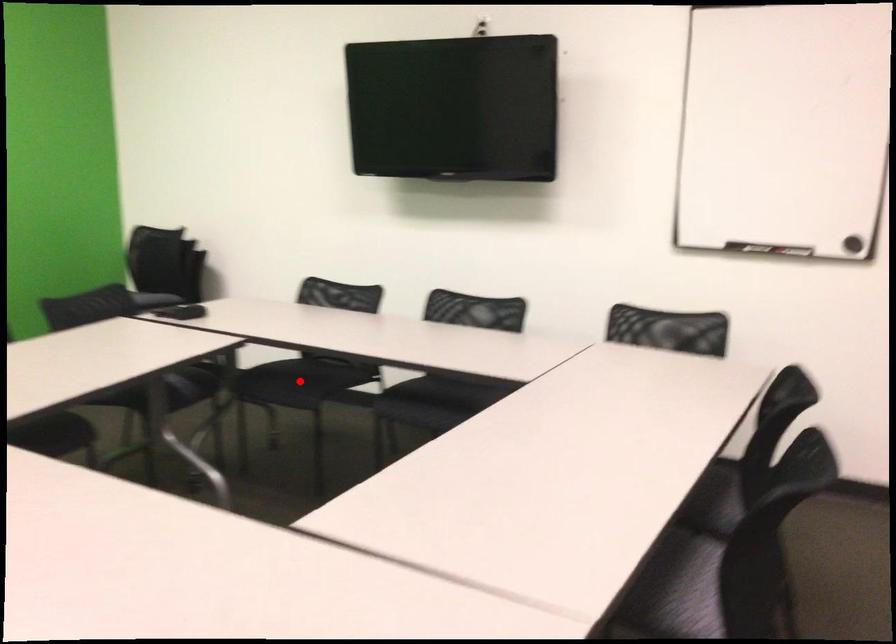
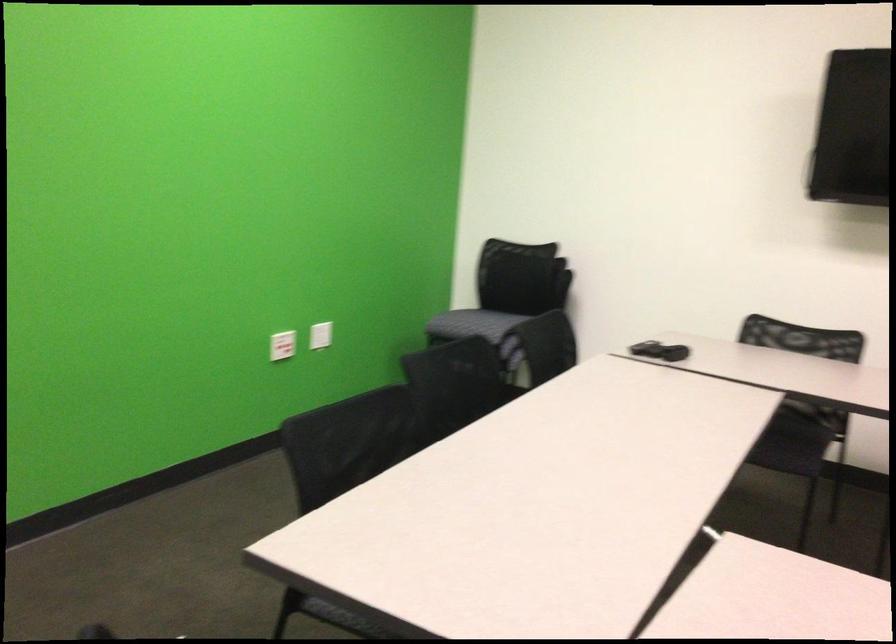
Find the pixel in the second image that matches the highlighted location in the first image.

(781, 422)